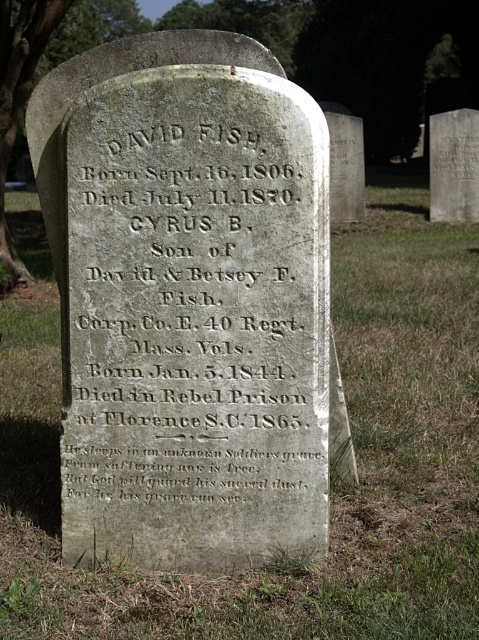
Question: Is gray stone inscription at center positioned at the back of smooth gray stone at upper right?

Choices:
 (A) yes
 (B) no

Answer: (B)

Question: Does gray stone inscription at center have a lesser width compared to smooth gray stone at upper right?

Choices:
 (A) yes
 (B) no

Answer: (B)

Question: Does gray stone inscription at center have a smaller size compared to smooth gray stone at upper right?

Choices:
 (A) yes
 (B) no

Answer: (A)

Question: Which point appears closest to the camera in this image?

Choices:
 (A) pos(72,170)
 (B) pos(468,113)

Answer: (A)

Question: Which object appears farthest from the camera in this image?

Choices:
 (A) smooth gray stone at upper right
 (B) gray stone inscription at center

Answer: (A)